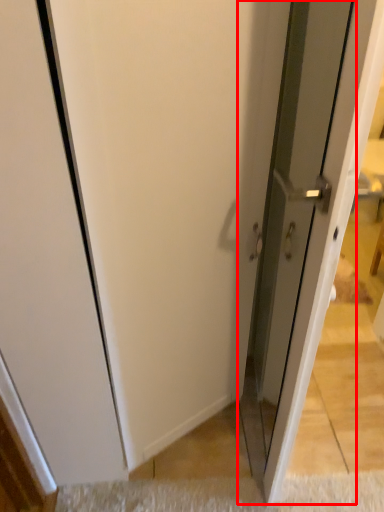
Question: From the image's perspective, where is screen door (annotated by the red box) located in relation to doormat in the image?

Choices:
 (A) above
 (B) below

Answer: (A)